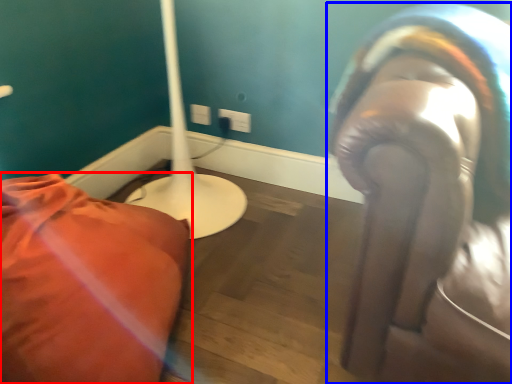
Question: Which of the following is the farthest to the observer, furniture (highlighted by a red box) or person (highlighted by a blue box)?

Choices:
 (A) furniture
 (B) person

Answer: (B)